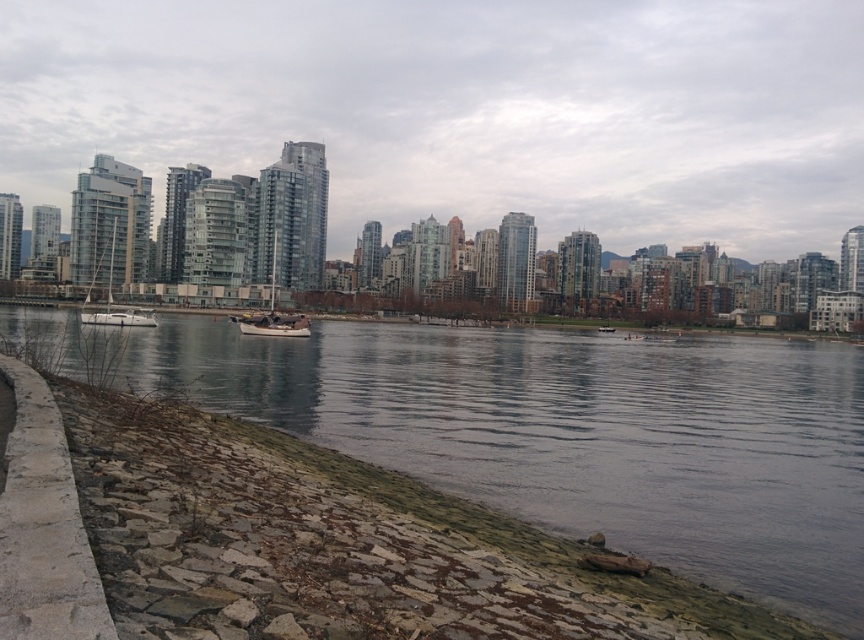
Question: Among these objects, which one is farthest from the camera?

Choices:
 (A) smooth concrete river at lower left
 (B) wooden sailboat at center

Answer: (B)

Question: Does smooth concrete river at lower left appear on the left side of white glossy sailboat at left?

Choices:
 (A) yes
 (B) no

Answer: (B)

Question: Is white glossy sailboat at left behind wooden sailboat at center?

Choices:
 (A) yes
 (B) no

Answer: (A)

Question: Which object is closer to the camera taking this photo?

Choices:
 (A) smooth concrete river at lower left
 (B) white glossy sailboat at left

Answer: (A)

Question: Which object appears farthest from the camera in this image?

Choices:
 (A) wooden sailboat at center
 (B) white glossy sailboat at left

Answer: (B)

Question: Observing the image, what is the correct spatial positioning of smooth concrete river at lower left in reference to white glossy sailboat at left?

Choices:
 (A) above
 (B) below

Answer: (B)